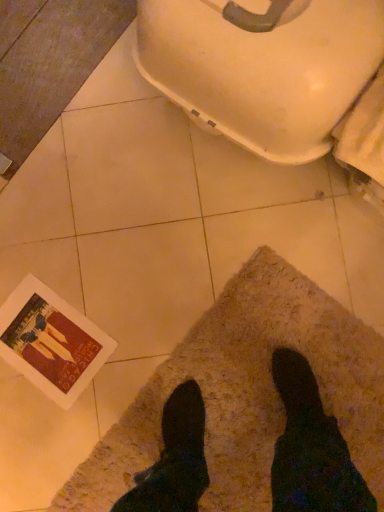
Question: Considering the positions of point (84, 480) and point (344, 20), is point (84, 480) closer or farther from the camera than point (344, 20)?

Choices:
 (A) farther
 (B) closer

Answer: (A)

Question: Considering the positions of beige shaggy mat at lower center and white glossy toilet bowl at upper right in the image, is beige shaggy mat at lower center wider or thinner than white glossy toilet bowl at upper right?

Choices:
 (A) wide
 (B) thin

Answer: (A)

Question: From a real-world perspective, relative to white glossy toilet bowl at upper right, is beige shaggy mat at lower center vertically above or below?

Choices:
 (A) below
 (B) above

Answer: (A)

Question: Is white glossy toilet bowl at upper right in front of or behind beige shaggy mat at lower center in the image?

Choices:
 (A) behind
 (B) front

Answer: (B)

Question: In terms of width, does white glossy toilet bowl at upper right look wider or thinner when compared to beige shaggy mat at lower center?

Choices:
 (A) wide
 (B) thin

Answer: (B)

Question: Visually, is white glossy toilet bowl at upper right positioned to the left or to the right of beige shaggy mat at lower center?

Choices:
 (A) left
 (B) right

Answer: (A)

Question: Is white glossy toilet bowl at upper right taller or shorter than beige shaggy mat at lower center?

Choices:
 (A) tall
 (B) short

Answer: (A)